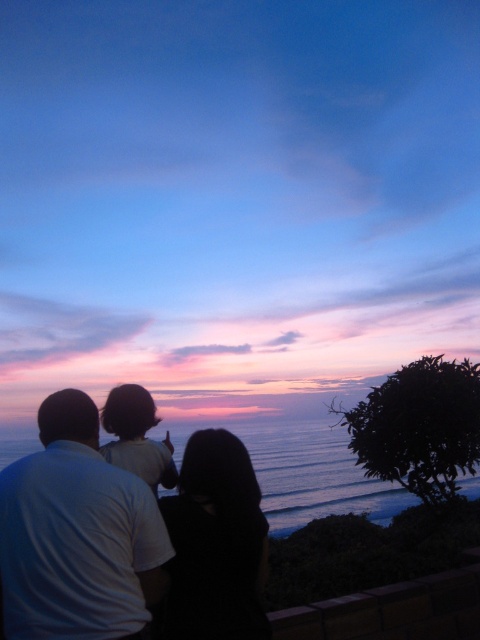
Question: Which point appears closest to the camera in this image?

Choices:
 (A) (128, 396)
 (B) (303, 442)
 (C) (179, 508)

Answer: (C)

Question: Is black matte hair at center thinner than blue water at lower center?

Choices:
 (A) no
 (B) yes

Answer: (B)

Question: Which of these objects is positioned closest to the dark hair at upper center?

Choices:
 (A) blue water at lower center
 (B) white matte shirt at upper left
 (C) black matte hair at center

Answer: (C)

Question: Is white matte shirt at upper left positioned at the back of dark hair at upper center?

Choices:
 (A) yes
 (B) no

Answer: (B)

Question: Which of these objects is positioned closest to the white matte shirt at upper left?

Choices:
 (A) blue water at lower center
 (B) black matte hair at center

Answer: (B)

Question: Does blue water at lower center have a lesser width compared to dark hair at upper center?

Choices:
 (A) no
 (B) yes

Answer: (A)